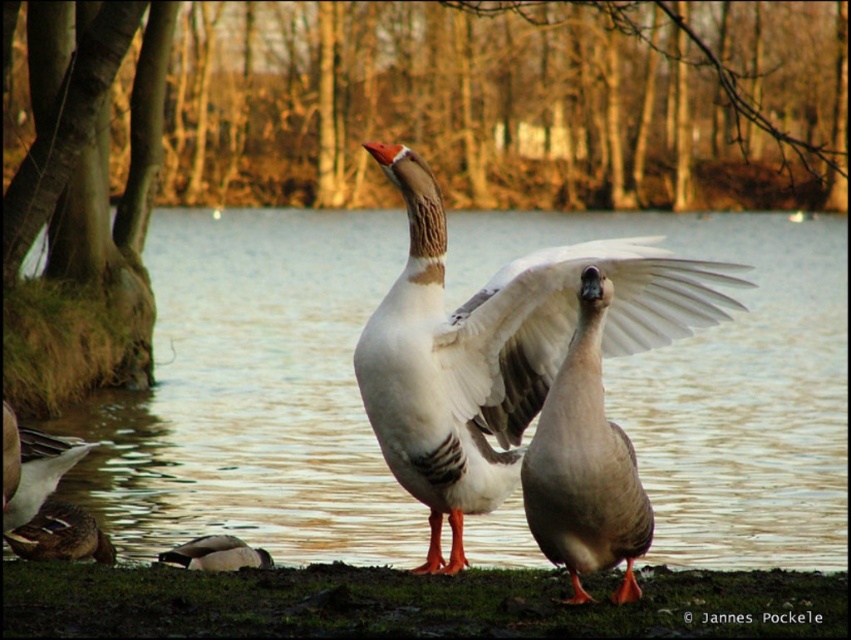
Does point (618, 531) come in front of point (178, 561)?

Yes, it is in front of point (178, 561).

Between point (632, 557) and point (266, 554), which one is positioned in front?

Point (632, 557) is in front.

The height and width of the screenshot is (640, 851). What do you see at coordinates (585, 465) in the screenshot?
I see `matte gray duck at center` at bounding box center [585, 465].

Identify the location of matte gray duck at center. (585, 465).

Who is taller, brown water at center or white feathered wing at center?

With more height is brown water at center.

Where is `brown water at center`? brown water at center is located at coordinates (254, 394).

Locate an element on the screen. This screenshot has height=640, width=851. brown water at center is located at coordinates (254, 394).

Between brown water at center and brown fuzzy duck at lower left, which one has less height?

With less height is brown fuzzy duck at lower left.

Image resolution: width=851 pixels, height=640 pixels. Describe the element at coordinates (254, 394) in the screenshot. I see `brown water at center` at that location.

The image size is (851, 640). Find the location of `brown water at center`. brown water at center is located at coordinates (254, 394).